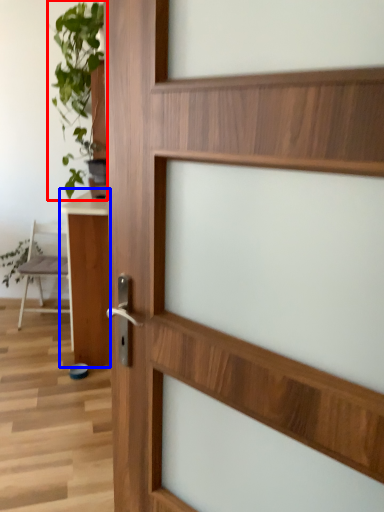
Question: Which of the following is the farthest to the observer, houseplant (highlighted by a red box) or table (highlighted by a blue box)?

Choices:
 (A) houseplant
 (B) table

Answer: (A)